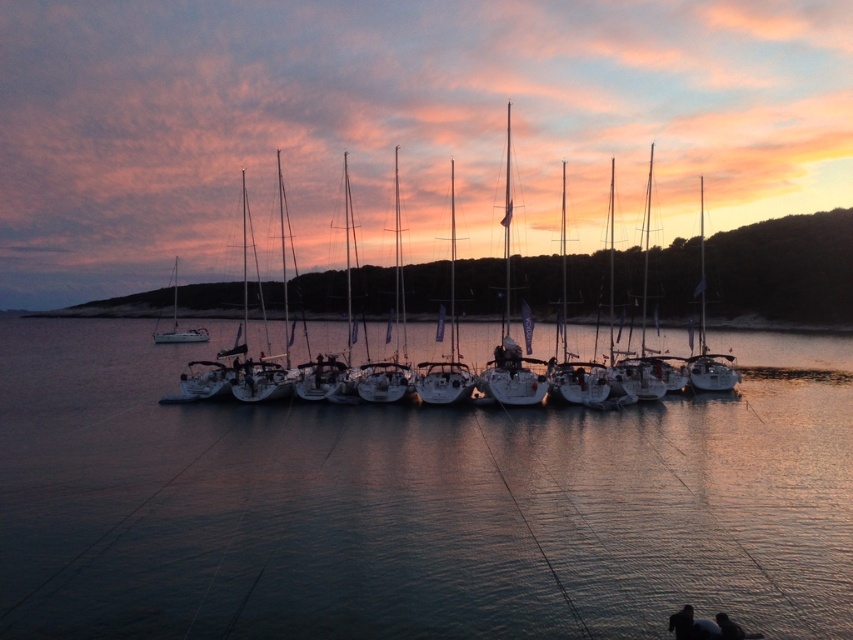
You are a photographer planning to capture the sunset at the marina. You want to ensure that both the white matte sailboat at center and the white matte sailboat at left are fully visible in your shot. Given that your camera frame can only accommodate a width of 10 meters, and the combined width of both sailboats is 12 meters, will you be able to fit both boats in the frame?

The combined width of the white matte sailboat at center and the white matte sailboat at left is 12 meters, which exceeds the camera frame capacity of 10 meters. Therefore, you cannot fit both boats in the frame.

You are standing at the marina and want to take a photo of the sunset. You notice two points in the scene at coordinates point (842, 381) and point (535, 397). Which point is closer to you?

Point (535, 397) is closer to you because it is less further to the camera than point (842, 381).

In the scene shown: You are a photographer planning to take a sunset photo of the white matte sailboat at center and the white matte sailboat at left. Based on their positions, which sailboat should you focus on first if you want to capture them in order from top to bottom?

The white matte sailboat at center should be focused on first as it is positioned above the white matte sailboat at left, so capturing them from top to bottom would start with the one at center.